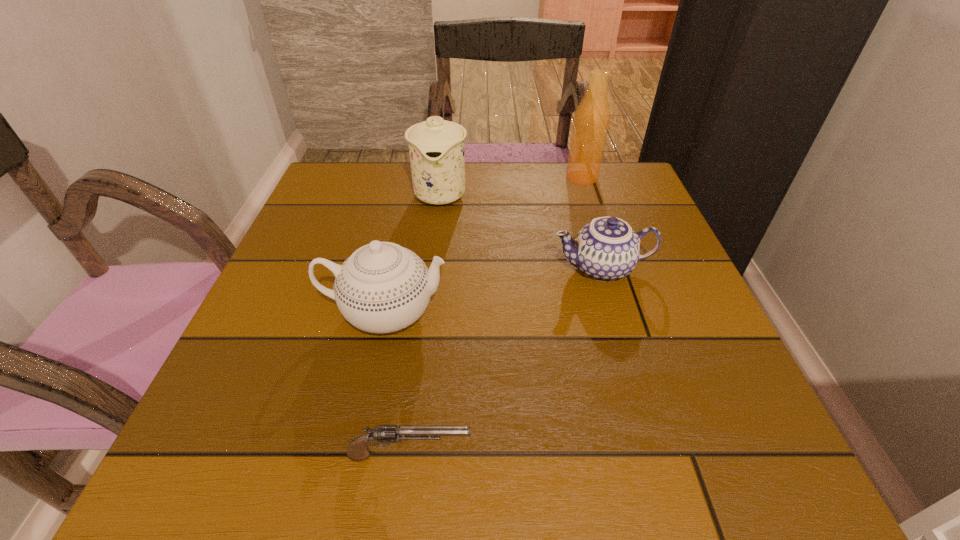
Find the location of a particular element. The height and width of the screenshot is (540, 960). chinaware that is at the right edge is located at coordinates (606, 249).

Where is `object that is positioned at the far right corner`? Image resolution: width=960 pixels, height=540 pixels. object that is positioned at the far right corner is located at coordinates (591, 121).

At what (x,y) coordinates should I click in order to perform the action: click on blank space at the far edge of the desktop. Please return your answer as a coordinate pair (x, y). This screenshot has width=960, height=540. Looking at the image, I should click on (492, 180).

The image size is (960, 540). In the image, there is a desktop. Identify the location of blank space at the near edge. (531, 440).

At what (x,y) coordinates should I click in order to perform the action: click on vacant area at the left edge of the desktop. Please return your answer as a coordinate pair (x, y). Looking at the image, I should click on (232, 407).

In the image, there is a desktop. What are the coordinates of `vacant space at the right edge` in the screenshot? It's located at (656, 314).

In the image, there is a desktop. Where is `vacant space at the far left corner`? This screenshot has height=540, width=960. vacant space at the far left corner is located at coordinates (346, 188).

Locate an element on the screen. blank area at the far right corner is located at coordinates (593, 207).

Where is `empty space that is in between the second shortest chinaware and the nearest object`? empty space that is in between the second shortest chinaware and the nearest object is located at coordinates (397, 384).

I want to click on free space between the tallest object and the gun, so click(495, 316).